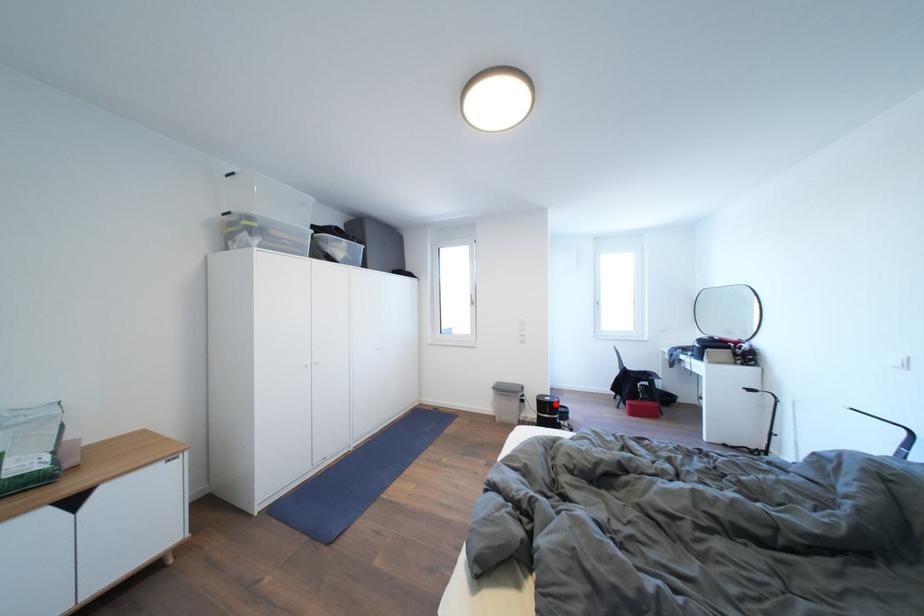
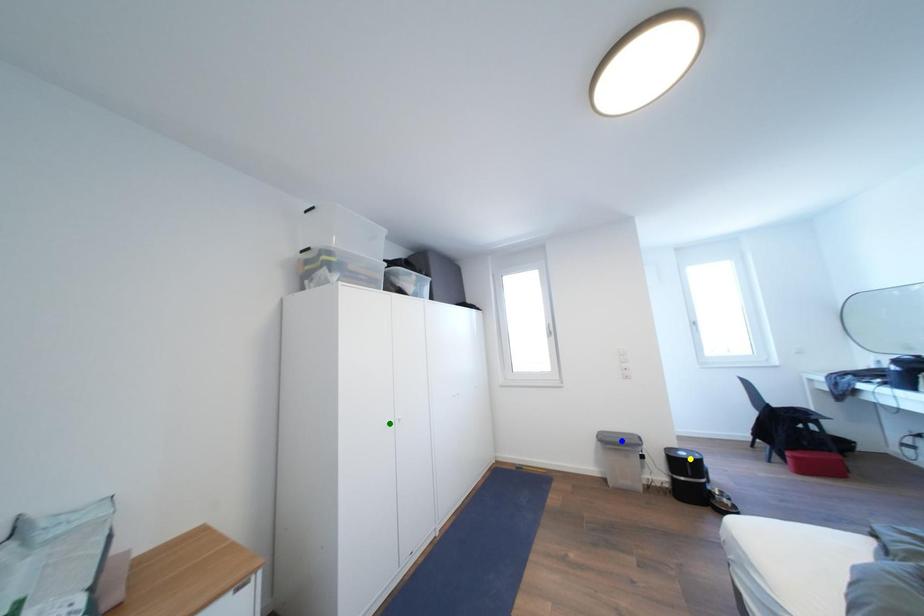
Question: I am providing you with two images of the same scene from different viewpoints. A red point is marked on the first image. You are given multiple points on the second image. Which spot in image 2 lines up with the point in image 1?

Choices:
 (A) green point
 (B) blue point
 (C) yellow point

Answer: (C)